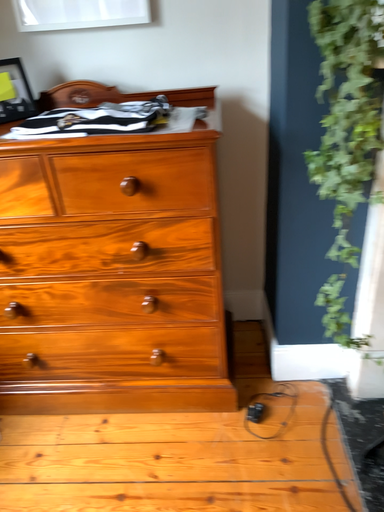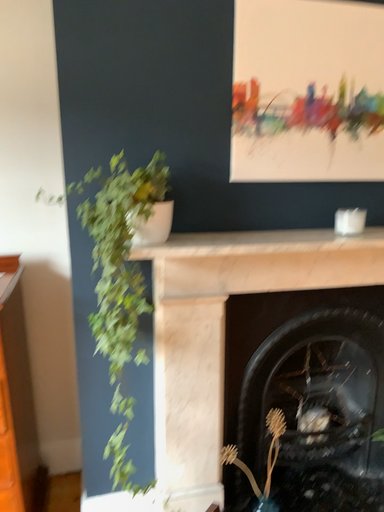
Question: How did the camera likely rotate when shooting the video?

Choices:
 (A) rotated downward
 (B) rotated upward

Answer: (B)